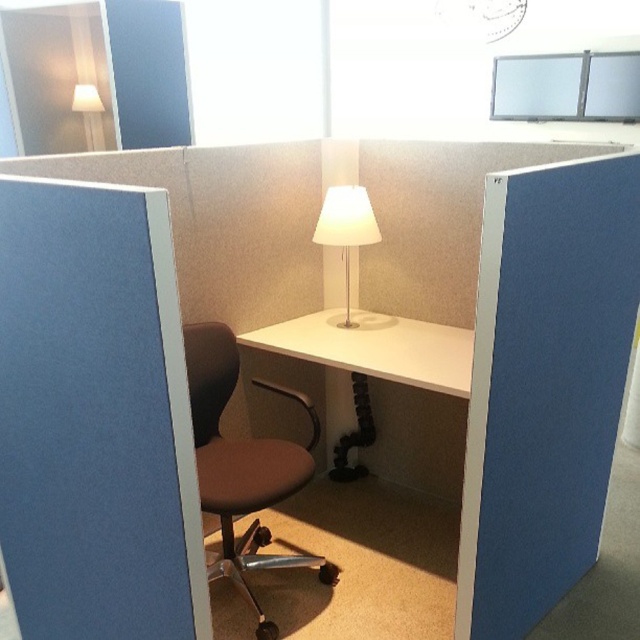
Locate an element on the screen. This screenshot has width=640, height=640. brown fabric swivel chair at center is located at coordinates pyautogui.click(x=243, y=465).

Which is behind, point (280, 467) or point (348, 330)?

The point (348, 330) is behind.

I want to click on brown fabric swivel chair at center, so 243,465.

Does white glossy computer desk at center have a greater width compared to white matte lamp at center?

Yes, white glossy computer desk at center is wider than white matte lamp at center.

Which of these two, white glossy computer desk at center or white matte lamp at center, stands taller?

white glossy computer desk at center

Identify the location of white glossy computer desk at center. (376, 348).

Where is `white glossy computer desk at center`? The width and height of the screenshot is (640, 640). white glossy computer desk at center is located at coordinates (376, 348).

Between point (269, 624) and point (324, 204), which one is positioned behind?

The point (324, 204) is more distant.

Where is `brown fabric swivel chair at center`? brown fabric swivel chair at center is located at coordinates (243, 465).